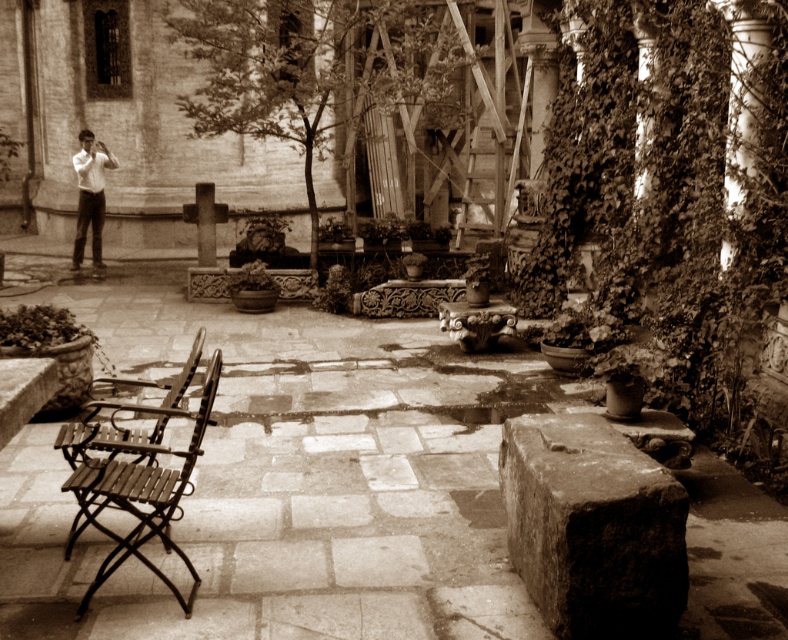
Question: Which point is closer to the camera taking this photo?

Choices:
 (A) pyautogui.click(x=93, y=214)
 (B) pyautogui.click(x=212, y=232)
 (C) pyautogui.click(x=103, y=435)

Answer: (C)

Question: Is white shirt at left above smooth stone pillar at center?

Choices:
 (A) no
 (B) yes

Answer: (B)

Question: Among these points, which one is farthest from the camera?

Choices:
 (A) (112, 499)
 (B) (209, 205)
 (C) (88, 212)

Answer: (C)

Question: Does metallic brown chair at lower left have a lesser width compared to white smooth column at right?

Choices:
 (A) no
 (B) yes

Answer: (A)

Question: Does metallic brown chair at lower left appear on the left side of white smooth column at right?

Choices:
 (A) no
 (B) yes

Answer: (B)

Question: Which object appears farthest from the camera in this image?

Choices:
 (A) white smooth column at right
 (B) metallic brown chair at lower left
 (C) white shirt at left
 (D) smooth stone pillar at center

Answer: (C)